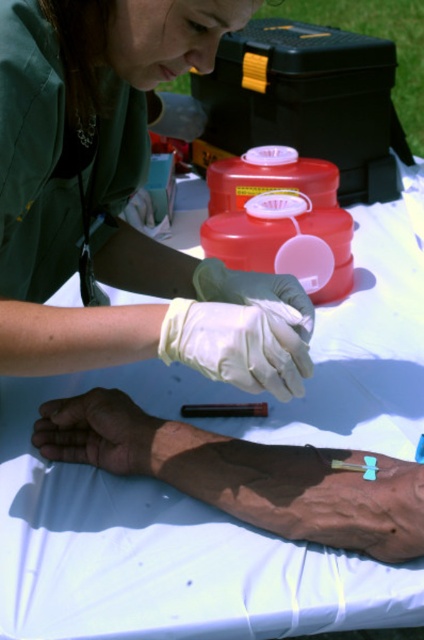
Question: Is matte green uniform at upper left wider than dry skin at center?

Choices:
 (A) no
 (B) yes

Answer: (B)

Question: Estimate the real-world distances between objects in this image. Which object is closer to the matte green uniform at upper left?

Choices:
 (A) blue latex glove at center
 (B) dry skin at center

Answer: (A)

Question: Is matte green uniform at upper left smaller than blue latex glove at center?

Choices:
 (A) yes
 (B) no

Answer: (B)

Question: Considering the real-world distances, which object is farthest from the dry skin at center?

Choices:
 (A) white leather glove at center
 (B) matte green uniform at upper left
 (C) blue latex glove at center

Answer: (B)

Question: Observing the image, what is the correct spatial positioning of matte green uniform at upper left in reference to dry skin at center?

Choices:
 (A) left
 (B) right

Answer: (B)

Question: Which of these objects is positioned farthest from the blue latex glove at center?

Choices:
 (A) dry skin at center
 (B) matte green uniform at upper left

Answer: (A)